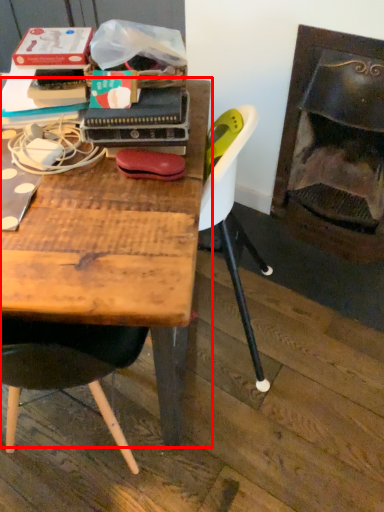
Question: From the image's perspective, where is table (annotated by the red box) located relative to fireplace?

Choices:
 (A) above
 (B) below

Answer: (B)